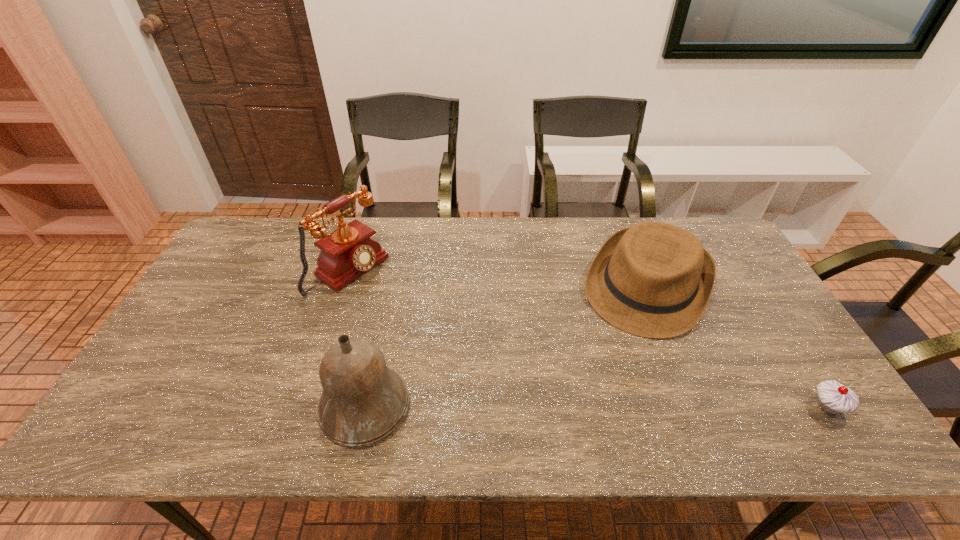
Image resolution: width=960 pixels, height=540 pixels. I want to click on object located in the near right corner section of the desktop, so click(833, 398).

Find the location of a particular element. free location at the far edge is located at coordinates (582, 233).

The width and height of the screenshot is (960, 540). I want to click on blank space at the near edge of the desktop, so [x=576, y=402].

Locate an element on the screen. The image size is (960, 540). free space at the far left corner of the desktop is located at coordinates (265, 239).

You are a GUI agent. You are given a task and a screenshot of the screen. Output one action in this format:
    pyautogui.click(x=<x>, y=<y>)
    Task: Click on the vacant space at the far right corner of the desktop
    This screenshot has height=540, width=960.
    Given the screenshot: What is the action you would take?
    pyautogui.click(x=700, y=221)

In the image, there is a desktop. At what (x,y) coordinates should I click in order to perform the action: click on free space at the near right corner. Please return your answer as a coordinate pair (x, y). Looking at the image, I should click on (812, 389).

Where is `free area in between the third object from left to right and the bell`? This screenshot has width=960, height=540. free area in between the third object from left to right and the bell is located at coordinates (506, 347).

This screenshot has height=540, width=960. Identify the location of free space that is in between the bell and the shortest object. coord(596,407).

Locate an element on the screen. The image size is (960, 540). free space between the rightmost object and the bell is located at coordinates (596, 407).

Find the location of a particular element. The width and height of the screenshot is (960, 540). empty space between the rightmost object and the telephone is located at coordinates (588, 339).